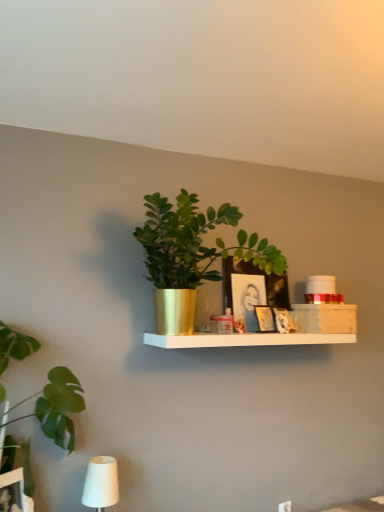
Question: Does wooden picture frame at center, which ranks as the first picture frame in front-to-back order, have a larger size compared to white matte table lamp at lower left?

Choices:
 (A) yes
 (B) no

Answer: (B)

Question: Is wooden picture frame at center, which ranks as the first picture frame in front-to-back order, taller than white matte table lamp at lower left?

Choices:
 (A) yes
 (B) no

Answer: (B)

Question: Considering the relative positions of wooden picture frame at center, which ranks as the first picture frame in front-to-back order, and white matte table lamp at lower left in the image provided, is wooden picture frame at center, which ranks as the first picture frame in front-to-back order, to the left of white matte table lamp at lower left from the viewer's perspective?

Choices:
 (A) yes
 (B) no

Answer: (B)

Question: Is wooden picture frame at center, which ranks as the first picture frame in front-to-back order, smaller than white matte table lamp at lower left?

Choices:
 (A) no
 (B) yes

Answer: (B)

Question: Could white matte table lamp at lower left be considered to be inside wooden picture frame at center, which ranks as the first picture frame in front-to-back order?

Choices:
 (A) no
 (B) yes

Answer: (A)

Question: From a real-world perspective, is wooden picture frame at center, which ranks as the first picture frame in front-to-back order, positioned above or below white matte table lamp at lower left?

Choices:
 (A) below
 (B) above

Answer: (B)

Question: Relative to white matte table lamp at lower left, is wooden picture frame at center, placed as the 4th picture frame when sorted from back to front, in front or behind?

Choices:
 (A) front
 (B) behind

Answer: (B)

Question: Visually, is wooden picture frame at center, which ranks as the first picture frame in front-to-back order, positioned to the left or to the right of white matte table lamp at lower left?

Choices:
 (A) right
 (B) left

Answer: (A)

Question: Would you say wooden picture frame at center, which ranks as the first picture frame in front-to-back order, is inside or outside white matte table lamp at lower left?

Choices:
 (A) inside
 (B) outside

Answer: (B)

Question: Is point (54, 391) closer or farther from the camera than point (253, 294)?

Choices:
 (A) farther
 (B) closer

Answer: (B)

Question: From a real-world perspective, is green leafy plant at left, arranged as the 2th houseplant when viewed from the right, positioned above or below matte black picture frame at center, acting as the 2th picture frame starting from the back?

Choices:
 (A) above
 (B) below

Answer: (B)

Question: Choose the correct answer: Is green leafy plant at left, positioned as the first houseplant in left-to-right order, inside matte black picture frame at center, which is the third picture frame in front-to-back order, or outside it?

Choices:
 (A) inside
 (B) outside

Answer: (B)

Question: From their relative heights in the image, would you say green leafy plant at left, positioned as the first houseplant in left-to-right order, is taller or shorter than matte black picture frame at center, which is the third picture frame in front-to-back order?

Choices:
 (A) short
 (B) tall

Answer: (B)

Question: Is matte black picture frame at center, acting as the 2th picture frame starting from the back, inside the boundaries of gold metallic plant pot at center, the 2th houseplant from the left, or outside?

Choices:
 (A) outside
 (B) inside

Answer: (A)

Question: Is point (279, 298) closer or farther from the camera than point (163, 330)?

Choices:
 (A) farther
 (B) closer

Answer: (A)